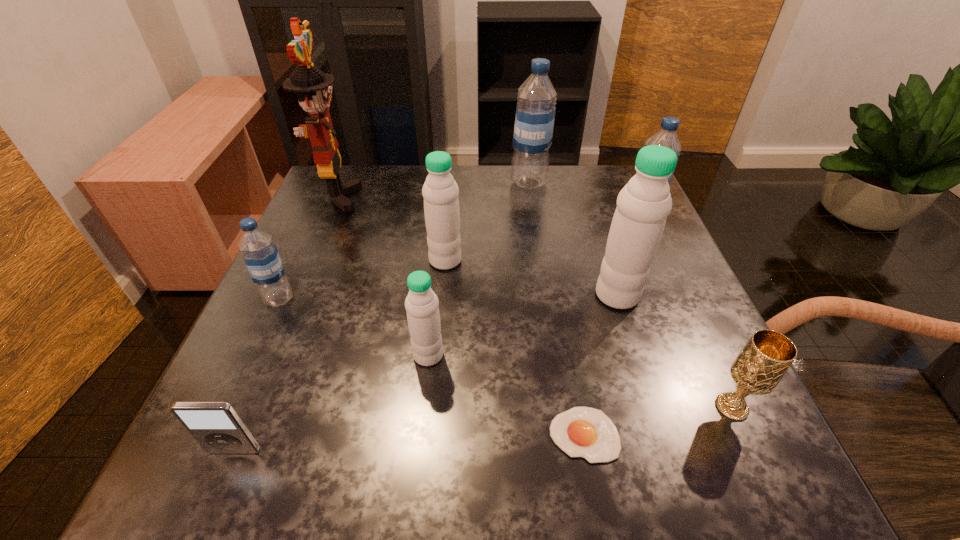
You are a GUI agent. You are given a task and a screenshot of the screen. Output one action in this format:
    pyautogui.click(x=<x>, y=<y>)
    Task: Click on the vacant space that satisfies the following two spatial constraints: 1. on the back side of the eighth tallest object; 2. on the front-facing side of the tallest object
    The image size is (960, 540).
    Given the screenshot: What is the action you would take?
    pyautogui.click(x=635, y=197)